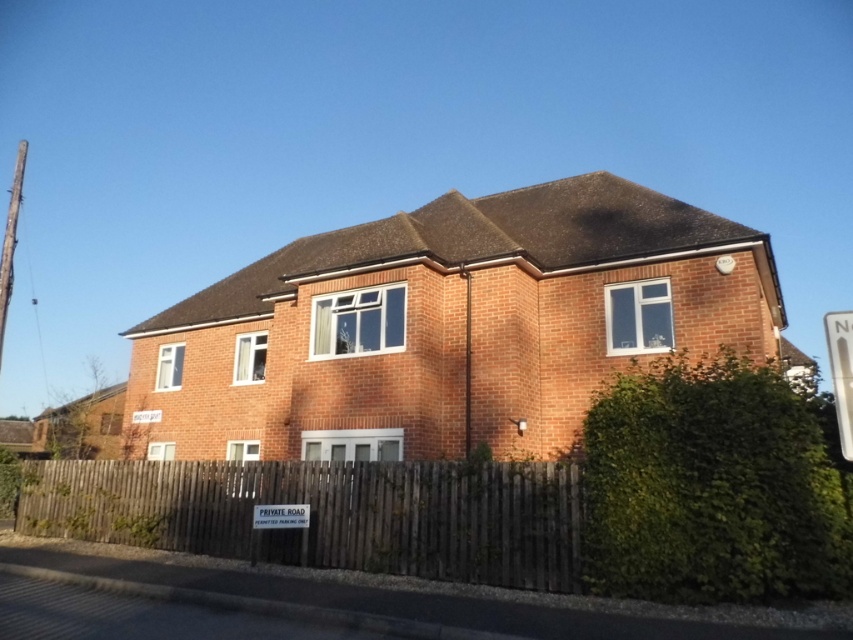
Image resolution: width=853 pixels, height=640 pixels. In order to click on white plastic sign at upper right in this screenshot , I will do `click(840, 372)`.

What do you see at coordinates (840, 372) in the screenshot? I see `white plastic sign at upper right` at bounding box center [840, 372].

Identify the location of white plastic sign at upper right. (840, 372).

Can you confirm if green leafy hedge at right is positioned above brown wooden fence at lower center?

Yes.

Between point (717, 486) and point (312, 520), which one is positioned behind?

Point (312, 520)

Where is `green leafy hedge at right`? This screenshot has height=640, width=853. green leafy hedge at right is located at coordinates (711, 486).

What do you see at coordinates (711, 486) in the screenshot? This screenshot has width=853, height=640. I see `green leafy hedge at right` at bounding box center [711, 486].

Which is above, green leafy hedge at right or white plastic sign at lower center?

green leafy hedge at right is higher up.

Between point (641, 401) and point (281, 512), which one is positioned behind?

Point (281, 512)

You are a GUI agent. You are given a task and a screenshot of the screen. Output one action in this format:
    pyautogui.click(x=<x>, y=<y>)
    Task: Click on the green leafy hedge at right
    
    Given the screenshot: What is the action you would take?
    pyautogui.click(x=711, y=486)